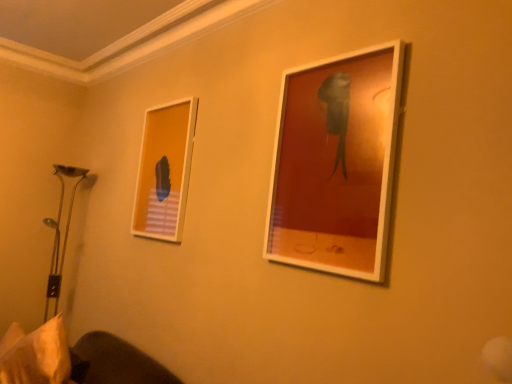
Question: From a real-world perspective, is white fabric pillow at lower left positioned above or below matte white picture frame at upper right, which appears as the second picture frame when viewed from the back?

Choices:
 (A) below
 (B) above

Answer: (A)

Question: Considering the relative positions of white fabric pillow at lower left and matte white picture frame at upper right, marked as the first picture frame in a front-to-back arrangement, in the image provided, is white fabric pillow at lower left to the left or to the right of matte white picture frame at upper right, marked as the first picture frame in a front-to-back arrangement,?

Choices:
 (A) right
 (B) left

Answer: (B)

Question: Considering the real-world distances, which object is farthest from the white fabric pillow at lower left?

Choices:
 (A) matte white picture frame at upper right, marked as the first picture frame in a front-to-back arrangement
 (B) matte white picture frame at upper left, the 2th picture frame from the front

Answer: (A)

Question: Which object is the farthest from the matte white picture frame at upper right, positioned as the second picture frame in left-to-right order?

Choices:
 (A) white fabric pillow at lower left
 (B) matte white picture frame at upper left, the 2th picture frame from the front

Answer: (A)